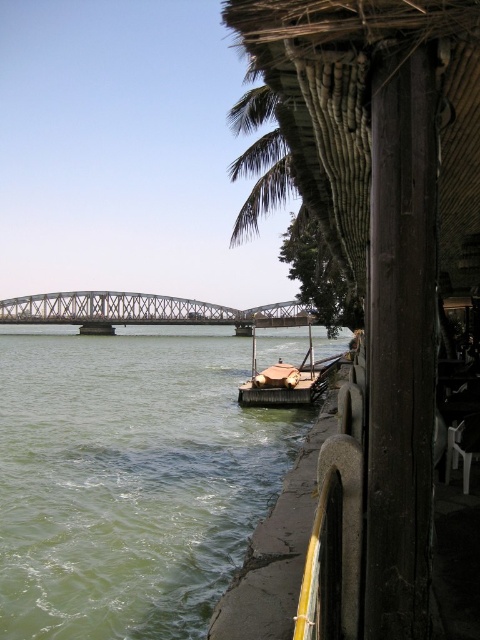
From the picture: You are standing at the riverside and see two points marked in the image. The first point is at coordinate point (391, 518) and the second is at point (86, 291). If you were to walk from the first point towards the second point, would you be moving towards the river or away from it?

Since point (391, 518) is in front of point (86, 291), moving from the first to the second point means you are moving away from the river.

In the scene shown: You are planning to build a small garden between the thatched straw hut at right and the green water at center. Considering their widths, which object should you place closer to the center to ensure the garden fits properly?

The thatched straw hut at right has a smaller width compared to the green water at center, so you should place the thatched straw hut at right closer to the center to accommodate the garden between them.